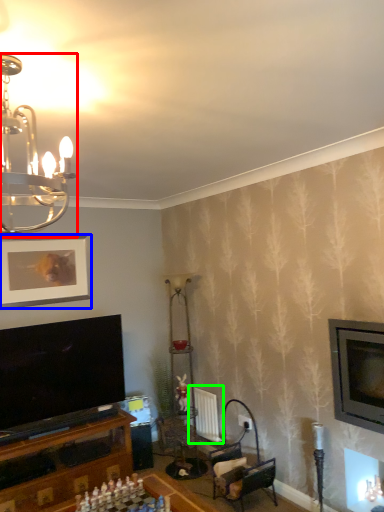
Question: Which object is the closest to the lamp (highlighted by a red box)? Choose among these: picture frame (highlighted by a blue box) or radiator (highlighted by a green box).

Choices:
 (A) picture frame
 (B) radiator

Answer: (A)